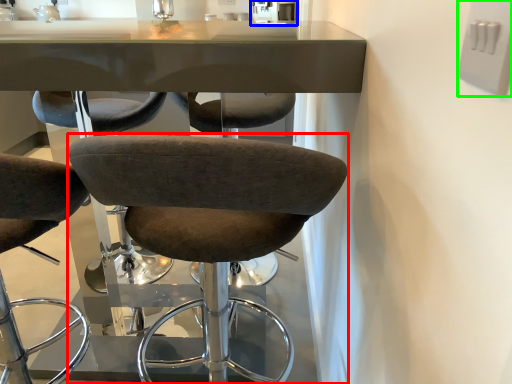
Question: Which object is positioned farthest from chair (highlighted by a red box)? Select from sink (highlighted by a blue box) and electric outlet (highlighted by a green box).

Choices:
 (A) sink
 (B) electric outlet

Answer: (A)